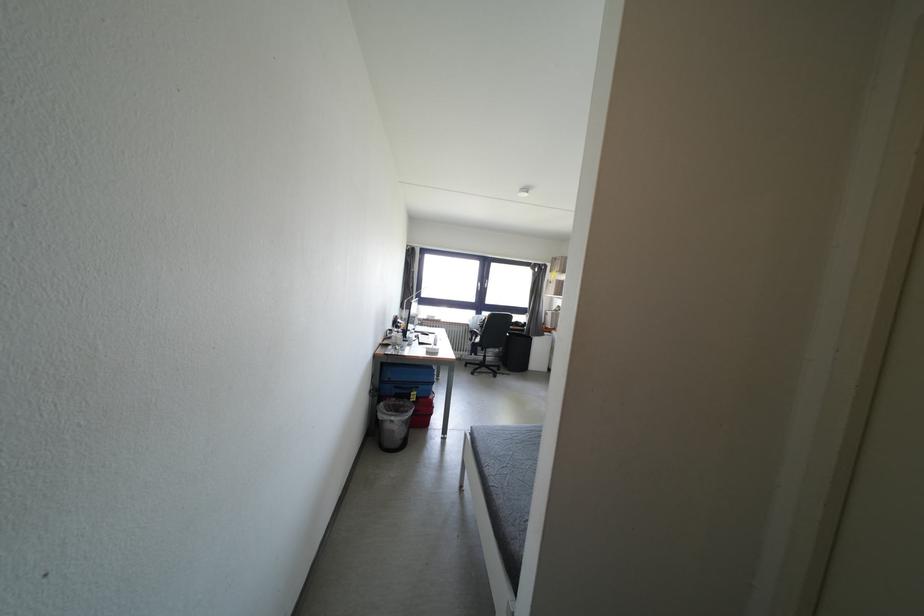
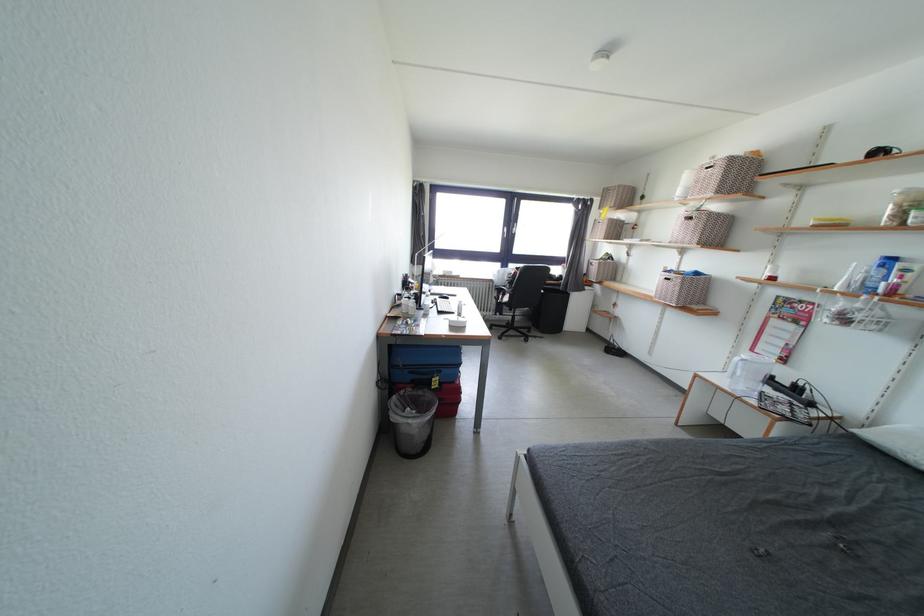
Where in the second image is the point corresponding to the point at 398,423 from the first image?

(417, 426)